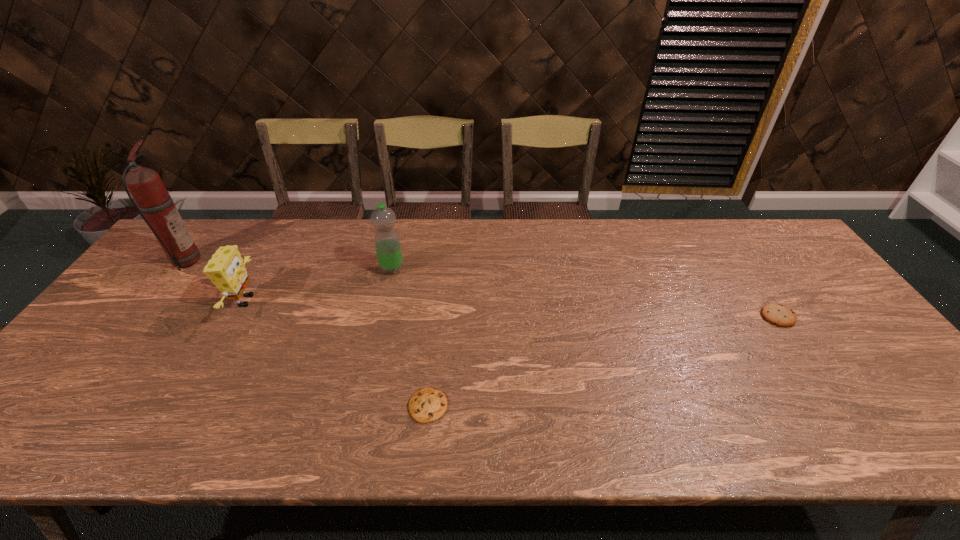
This screenshot has height=540, width=960. In order to click on free space between the third tallest object and the shorter cookie in this screenshot , I will do `click(337, 353)`.

Where is `empty location between the sponge and the water bottle`? The image size is (960, 540). empty location between the sponge and the water bottle is located at coordinates (319, 285).

The height and width of the screenshot is (540, 960). Find the location of `empty space between the second shortest object and the tallest object`. empty space between the second shortest object and the tallest object is located at coordinates (481, 288).

Locate an element on the screen. The width and height of the screenshot is (960, 540). vacant point located between the fourth object from right to left and the fourth tallest object is located at coordinates (512, 309).

Find the location of a particular element. vacant region between the farther cookie and the shorter cookie is located at coordinates (603, 361).

This screenshot has width=960, height=540. I want to click on vacant space that's between the nearer cookie and the right cookie, so pos(603,361).

Identify the location of the closest object to the farther cookie. This screenshot has height=540, width=960. (426, 405).

The width and height of the screenshot is (960, 540). Find the location of `the closest object to the farther cookie`. the closest object to the farther cookie is located at coordinates (426, 405).

The height and width of the screenshot is (540, 960). What are the coordinates of `vacant area in the image that satisfies the following two spatial constraints: 1. on the side of the shortest object with the label and nozzle; 2. on the right side of the fire extinguisher` in the screenshot? It's located at (72, 406).

Locate an element on the screen. The image size is (960, 540). vacant space that satisfies the following two spatial constraints: 1. on the front side of the water bottle; 2. on the face of the fourth object from right to left is located at coordinates (385, 301).